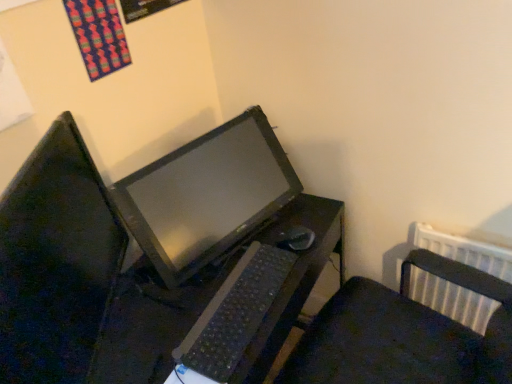
Question: Is black plastic mouse at center to the left of black plastic desk at center from the viewer's perspective?

Choices:
 (A) no
 (B) yes

Answer: (A)

Question: Is black plastic mouse at center taller than black plastic desk at center?

Choices:
 (A) yes
 (B) no

Answer: (B)

Question: Is the position of black plastic mouse at center less distant than that of black plastic desk at center?

Choices:
 (A) no
 (B) yes

Answer: (A)

Question: From a real-world perspective, is black plastic mouse at center physically above black plastic desk at center?

Choices:
 (A) no
 (B) yes

Answer: (B)

Question: Can you confirm if black plastic mouse at center is thinner than black plastic desk at center?

Choices:
 (A) yes
 (B) no

Answer: (A)

Question: Is black plastic mouse at center wider than black plastic desk at center?

Choices:
 (A) no
 (B) yes

Answer: (A)

Question: Does matte black monitor at center have a smaller size compared to black plastic desk at center?

Choices:
 (A) no
 (B) yes

Answer: (B)

Question: From the image's perspective, would you say matte black monitor at center is shown under black plastic desk at center?

Choices:
 (A) yes
 (B) no

Answer: (B)

Question: Does matte black monitor at center appear on the right side of black plastic desk at center?

Choices:
 (A) no
 (B) yes

Answer: (A)

Question: Considering the relative positions of matte black monitor at center and black plastic desk at center in the image provided, is matte black monitor at center to the left of black plastic desk at center from the viewer's perspective?

Choices:
 (A) yes
 (B) no

Answer: (A)

Question: Is matte black monitor at center shorter than black plastic desk at center?

Choices:
 (A) no
 (B) yes

Answer: (B)

Question: Does matte black monitor at center lie behind black plastic desk at center?

Choices:
 (A) no
 (B) yes

Answer: (A)

Question: Is black plastic desk at center facing towards black plastic keyboard at center?

Choices:
 (A) yes
 (B) no

Answer: (B)